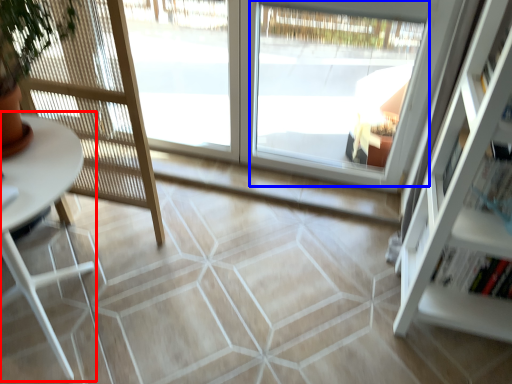
Question: Which of the following is the closest to the observer, table (highlighted by a red box) or window (highlighted by a blue box)?

Choices:
 (A) table
 (B) window

Answer: (A)